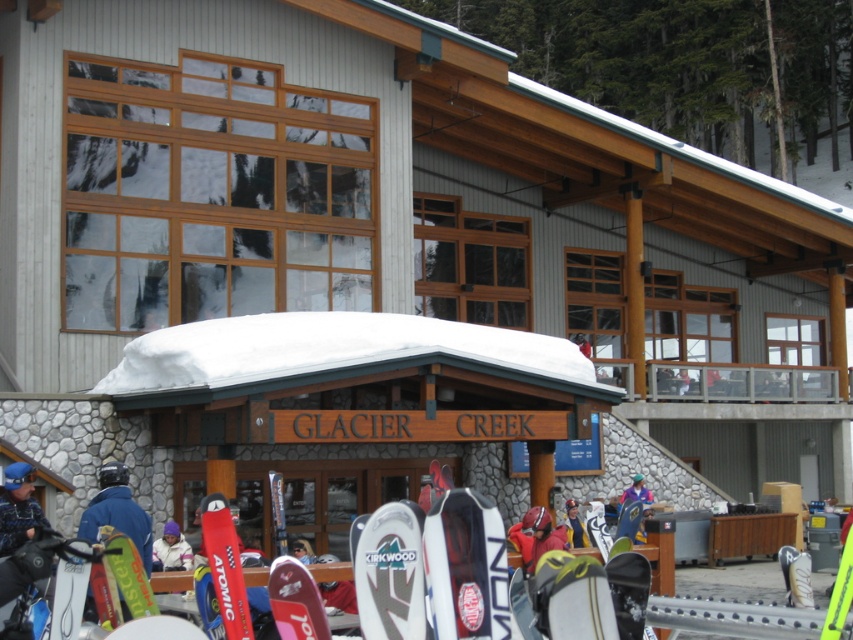
Question: Can you confirm if white matte snowboard at center is positioned below green plastic ski at lower left?

Choices:
 (A) yes
 (B) no

Answer: (A)

Question: Which point is farther to the camera?

Choices:
 (A) red matte ski at center
 (B) white matte ski at center
 (C) matte red ski at lower center
 (D) green plastic ski at lower left

Answer: (D)

Question: Which object is closer to the camera taking this photo?

Choices:
 (A) blue matte jacket at lower left
 (B) matte red ski at lower center

Answer: (B)

Question: Can you confirm if matte red ski at lower center is thinner than blue fleece jacket at lower left?

Choices:
 (A) no
 (B) yes

Answer: (B)

Question: Which object is farther from the camera taking this photo?

Choices:
 (A) matte red ski at lower center
 (B) white fleece jacket at center
 (C) red helmet at center
 (D) blue fleece jacket at lower left

Answer: (B)

Question: Does blue fleece jacket at lower left appear over red jacket at center?

Choices:
 (A) no
 (B) yes

Answer: (B)